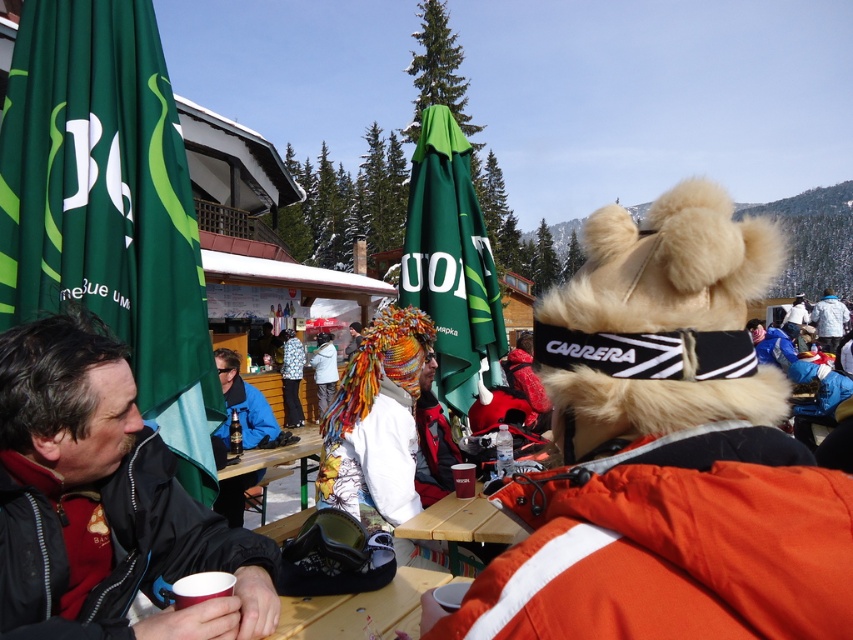
Where is `green fabric umbrella at center`? The height and width of the screenshot is (640, 853). green fabric umbrella at center is located at coordinates (451, 260).

The height and width of the screenshot is (640, 853). I want to click on green fabric umbrella at center, so click(451, 260).

Find the location of a particular element. green fabric umbrella at center is located at coordinates (451, 260).

Can you confirm if green fabric umbrella at center is taller than white fleece jacket at upper right?

Yes, green fabric umbrella at center is taller than white fleece jacket at upper right.

Can you confirm if green fabric umbrella at center is positioned to the right of white fleece jacket at upper right?

Incorrect, green fabric umbrella at center is not on the right side of white fleece jacket at upper right.

Where is `green fabric umbrella at center`? green fabric umbrella at center is located at coordinates (451, 260).

In order to click on green fabric umbrella at center in this screenshot , I will do `click(451, 260)`.

Consider the image. Is the position of green fabric umbrella at center more distant than that of wooden table at center?

Yes, green fabric umbrella at center is further from the viewer.

Does green fabric umbrella at center have a smaller size compared to wooden table at center?

No.

Who is more distant from viewer, (427,209) or (438,532)?

Point (427,209)

Where is `green fabric umbrella at center`? This screenshot has width=853, height=640. green fabric umbrella at center is located at coordinates (451, 260).